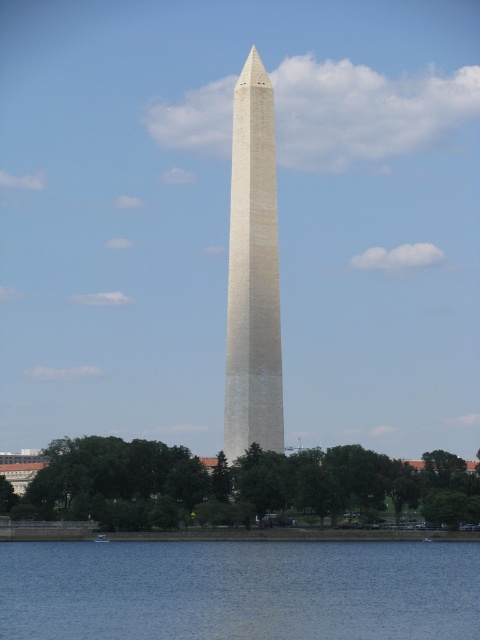
Can you confirm if blue water at lower center is thinner than white stone obelisk at center?

Incorrect, blue water at lower center's width is not less than white stone obelisk at center's.

Can you confirm if blue water at lower center is positioned to the right of white stone obelisk at center?

In fact, blue water at lower center is to the left of white stone obelisk at center.

The image size is (480, 640). Describe the element at coordinates (240, 589) in the screenshot. I see `blue water at lower center` at that location.

Locate an element on the screen. blue water at lower center is located at coordinates (240, 589).

Is green leafy tree at center positioned at the back of white stone obelisk at center?

No, green leafy tree at center is in front of white stone obelisk at center.

Is green leafy tree at center wider than white stone obelisk at center?

Correct, the width of green leafy tree at center exceeds that of white stone obelisk at center.

Does point (224, 476) come in front of point (240, 292)?

Yes, point (224, 476) is closer to viewer.

Identify the location of green leafy tree at center. (238, 484).

Is blue water at lower center to the left of green leafy tree at center from the viewer's perspective?

Yes, blue water at lower center is to the left of green leafy tree at center.

Which is above, blue water at lower center or green leafy tree at center?

Positioned higher is green leafy tree at center.

Looking at this image, who is more forward, (479,548) or (76,497)?

Point (76,497)

I want to click on blue water at lower center, so click(240, 589).